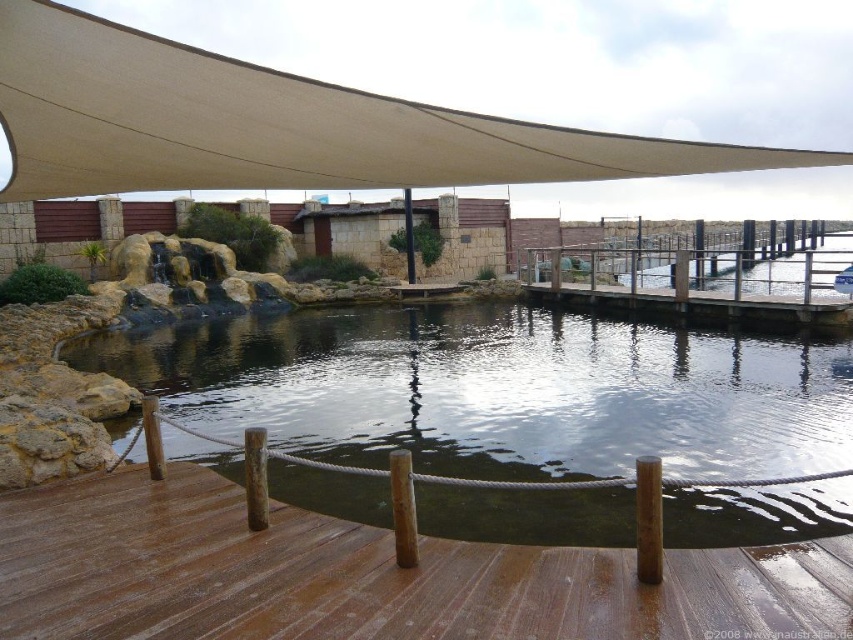
Question: Which is nearer to the beige fabric canopy at upper center?

Choices:
 (A) brown wooden deck at center
 (B) clear water at center

Answer: (B)

Question: Is clear water at center above brown wooden deck at center?

Choices:
 (A) yes
 (B) no

Answer: (A)

Question: Is clear water at center below brown wooden deck at center?

Choices:
 (A) yes
 (B) no

Answer: (B)

Question: Based on their relative distances, which object is farther from the brown wooden deck at center?

Choices:
 (A) clear water at center
 (B) beige fabric canopy at upper center

Answer: (B)

Question: Considering the relative positions of clear water at center and beige fabric canopy at upper center in the image provided, where is clear water at center located with respect to beige fabric canopy at upper center?

Choices:
 (A) above
 (B) below

Answer: (B)

Question: Which of these objects is positioned closest to the beige fabric canopy at upper center?

Choices:
 (A) clear water at center
 (B) brown wooden deck at center

Answer: (A)